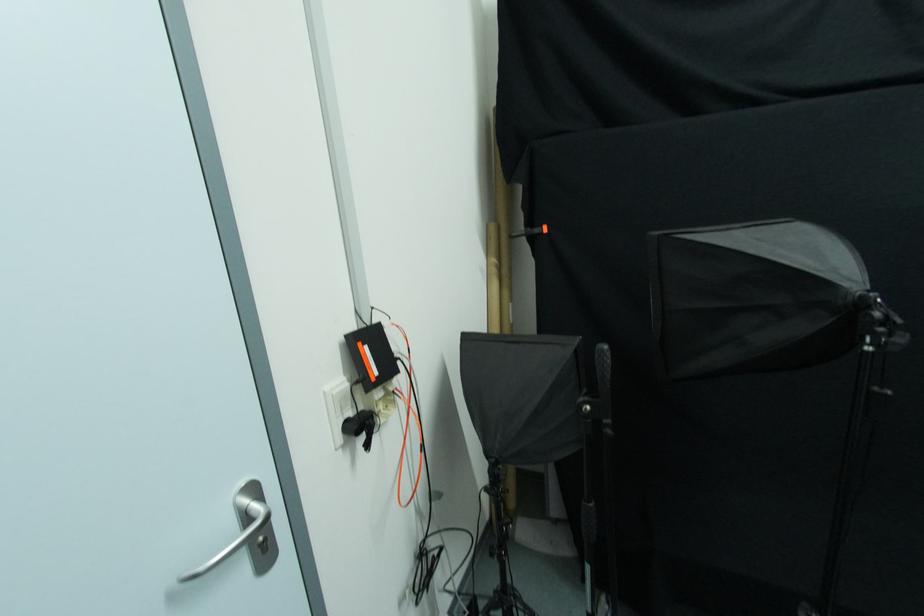
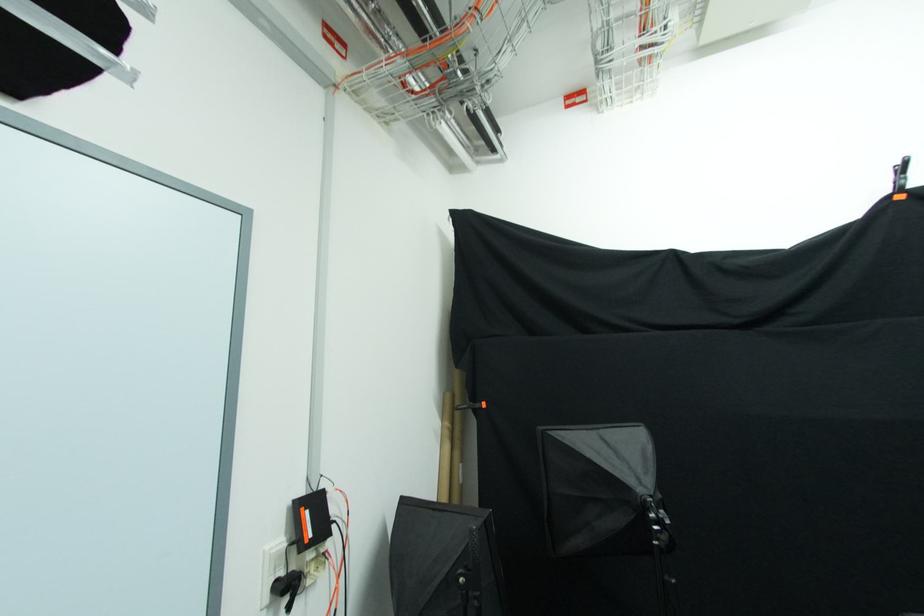
Where in the second image is the point corresponding to pixel 325 395 from the first image?

(266, 554)